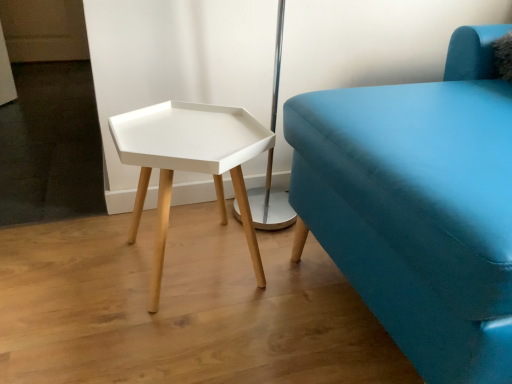
Question: From the image's perspective, is white matte hexagonal table at center positioned above or below matte blue fabric couch at right?

Choices:
 (A) above
 (B) below

Answer: (B)

Question: Is point (146, 107) positioned closer to the camera than point (506, 142)?

Choices:
 (A) closer
 (B) farther

Answer: (B)

Question: Looking at their shapes, would you say white matte hexagonal table at center is wider or thinner than matte blue fabric couch at right?

Choices:
 (A) wide
 (B) thin

Answer: (B)

Question: Based on their sizes in the image, would you say matte blue fabric couch at right is bigger or smaller than white matte hexagonal table at center?

Choices:
 (A) big
 (B) small

Answer: (A)

Question: From the image's perspective, is matte blue fabric couch at right above or below white matte hexagonal table at center?

Choices:
 (A) above
 (B) below

Answer: (A)

Question: Visually, is matte blue fabric couch at right positioned to the left or to the right of white matte hexagonal table at center?

Choices:
 (A) right
 (B) left

Answer: (A)

Question: In terms of height, does matte blue fabric couch at right look taller or shorter compared to white matte hexagonal table at center?

Choices:
 (A) tall
 (B) short

Answer: (A)